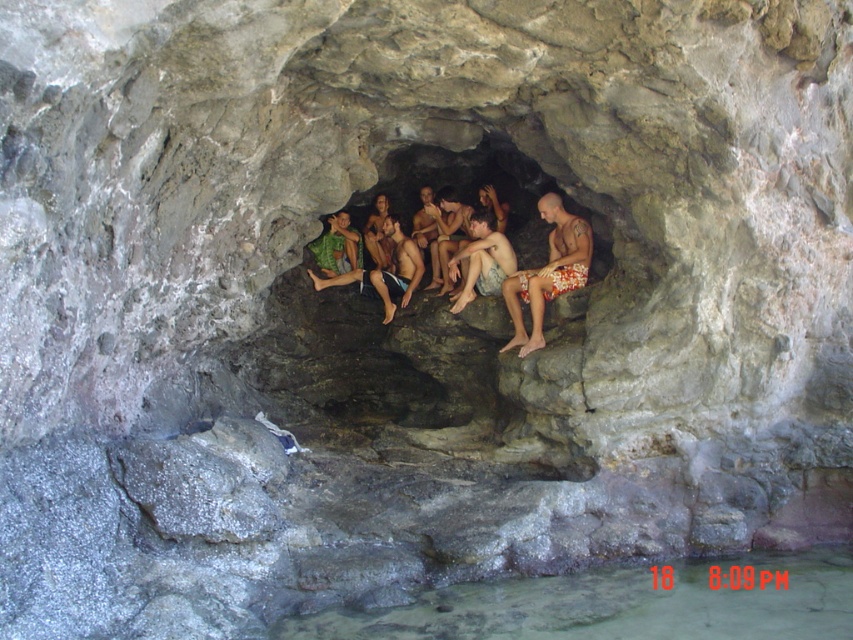
Question: Which object is the farthest from the floral print shorts at center?

Choices:
 (A) camouflage shorts at center
 (B) green fabric towel at center
 (C) clear water at lower center

Answer: (C)

Question: Does clear water at lower center come behind green fabric towel at center?

Choices:
 (A) no
 (B) yes

Answer: (A)

Question: Does green fabric towel at center lie in front of camouflage shorts at center?

Choices:
 (A) yes
 (B) no

Answer: (B)

Question: Based on their relative distances, which object is farther from the clear water at lower center?

Choices:
 (A) green fabric towel at center
 (B) floral print shorts at center
 (C) camouflage shorts at center

Answer: (A)

Question: Which point appears farthest from the camera in this image?

Choices:
 (A) (389, 621)
 (B) (416, 285)
 (C) (473, 221)
 (D) (540, 285)

Answer: (B)

Question: Is floral print shorts at center closer to camera compared to camouflage shorts at center?

Choices:
 (A) no
 (B) yes

Answer: (B)